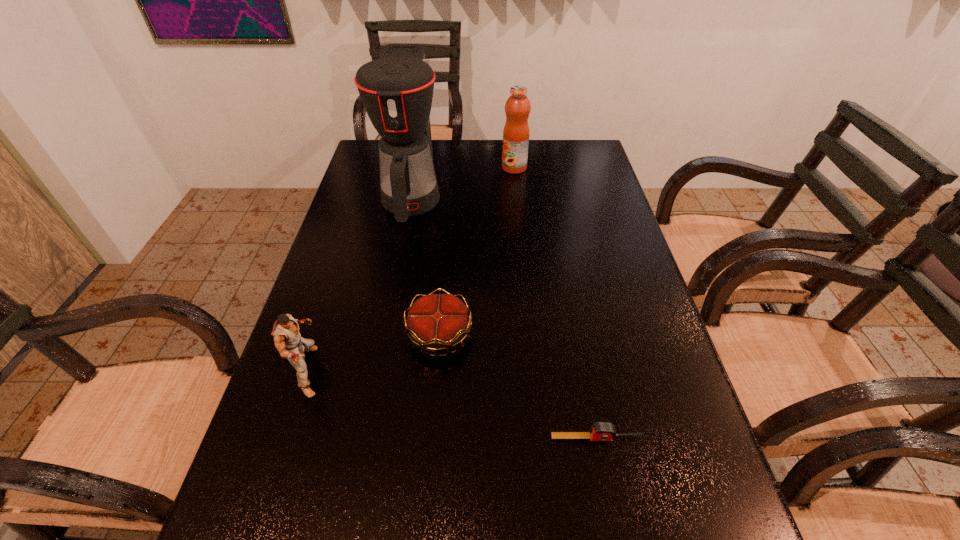
The height and width of the screenshot is (540, 960). In the image, there is a desktop. Find the location of `vacant space at the far edge`. vacant space at the far edge is located at coordinates (434, 161).

Where is `vacant point at the left edge`? This screenshot has height=540, width=960. vacant point at the left edge is located at coordinates (371, 265).

Identify the location of vacant space at the right edge of the desktop. This screenshot has height=540, width=960. (576, 176).

Locate an element on the screen. The height and width of the screenshot is (540, 960). vacant space at the far right corner of the desktop is located at coordinates (575, 158).

You are a GUI agent. You are given a task and a screenshot of the screen. Output one action in this format:
    pyautogui.click(x=<x>, y=<y>)
    Task: Click on the free area in between the fourth shortest object and the tape measure
    The height and width of the screenshot is (540, 960).
    Given the screenshot: What is the action you would take?
    pyautogui.click(x=556, y=303)

At what (x,y) coordinates should I click in order to perform the action: click on empty space between the shortest object and the second tallest object. Please return your answer as a coordinate pair (x, y). This screenshot has height=540, width=960. Looking at the image, I should click on (556, 303).

Where is `free space that is in between the crown and the puncher`? The height and width of the screenshot is (540, 960). free space that is in between the crown and the puncher is located at coordinates (374, 353).

You are a GUI agent. You are given a task and a screenshot of the screen. Output one action in this format:
    pyautogui.click(x=<x>, y=<y>)
    Task: Click on the unoccupied position between the puncher and the nearest object
    The image size is (960, 540).
    Given the screenshot: What is the action you would take?
    pyautogui.click(x=453, y=404)

You are a GUI agent. You are given a task and a screenshot of the screen. Output one action in this format:
    pyautogui.click(x=<x>, y=<y>)
    Task: Click on the empty space that is in between the fruit juice and the coffee maker
    The height and width of the screenshot is (540, 960).
    Given the screenshot: What is the action you would take?
    pyautogui.click(x=463, y=182)

Where is `object that can be found as the second closest to the coffee maker`? Image resolution: width=960 pixels, height=540 pixels. object that can be found as the second closest to the coffee maker is located at coordinates (436, 322).